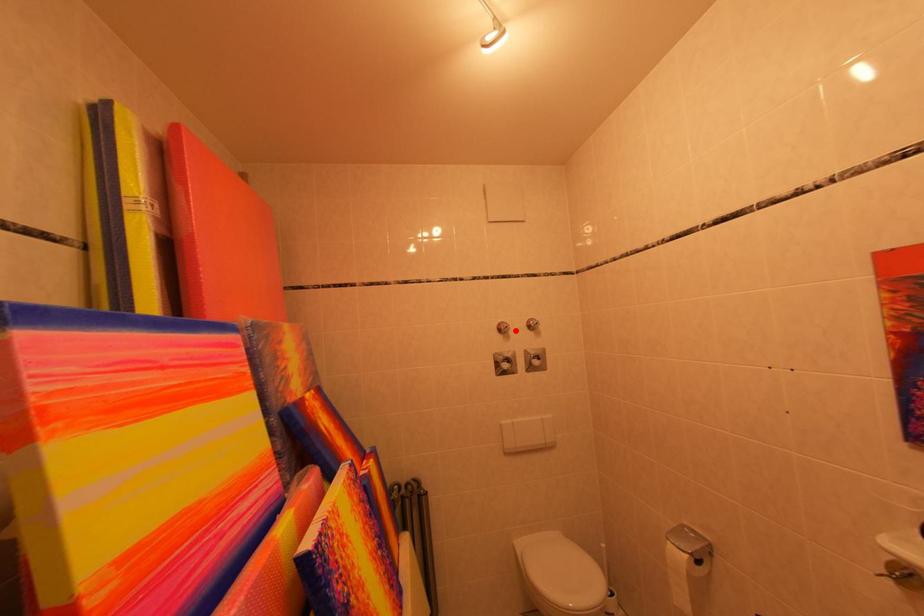
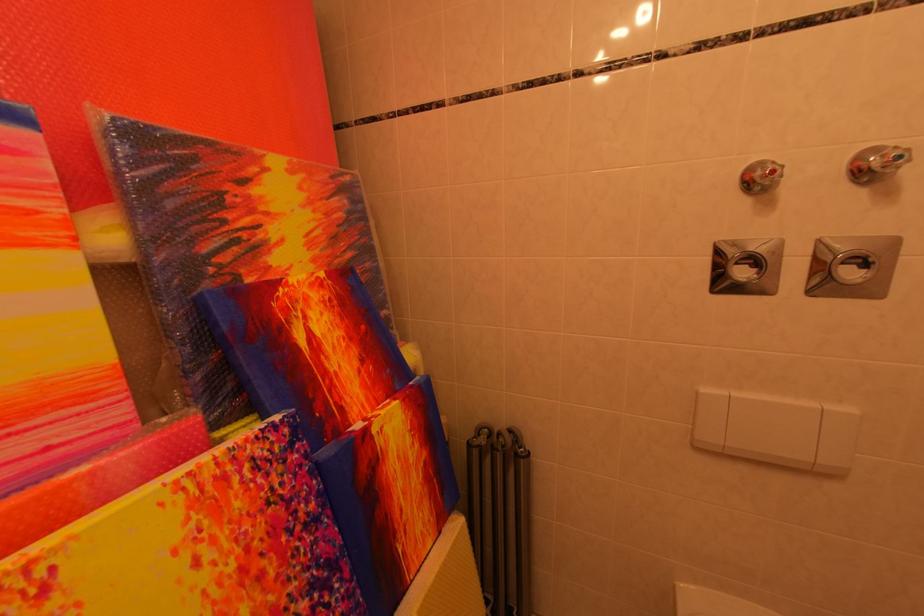
Locate, in the second image, the point that corresponds to the highlighted location in the first image.

(782, 176)